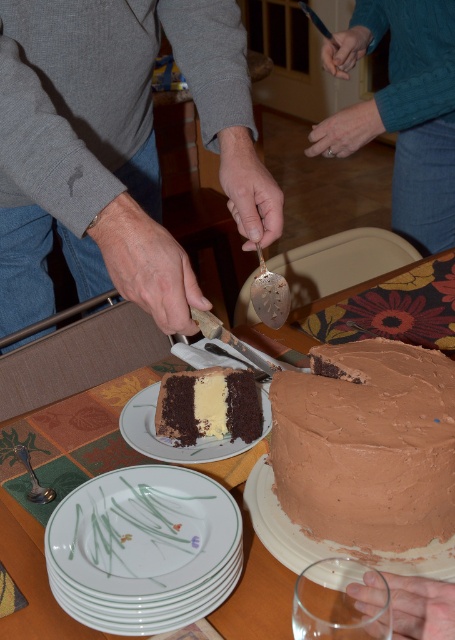
You are at a cake cutting event and want to reach a point marked at coordinates (262, 490) on the cake. If your hand is currently 10 inches away from the cake, how much further do you need to extend your hand to touch that point?

The point at coordinates (262, 490) is 23.17 inches away from the viewer. Since your hand is currently 10 inches away, you need to extend it an additional 13.17 inches to reach the point.

You are planning to serve the cake and need to know which cake is taller. You see the chocolate matte cake at center and the brown matte cake at center. Which one is taller?

The brown matte cake at center is taller than the chocolate matte cake at center.

In the scene shown: You are at a birthday party and want to take a photo of the smooth brown cake at center and the chocolatesmoothcake at center. Which cake should you focus on first to ensure both are in the frame?

You should focus on the smooth brown cake at center first because it is closer to you than the chocolatesmoothcake at center, ensuring both remain in the frame.